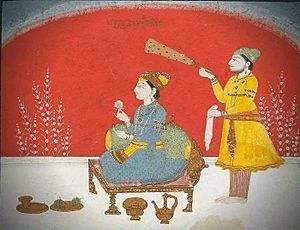
This screenshot has height=230, width=300. In order to click on white cloth in this screenshot , I will do `click(208, 133)`.